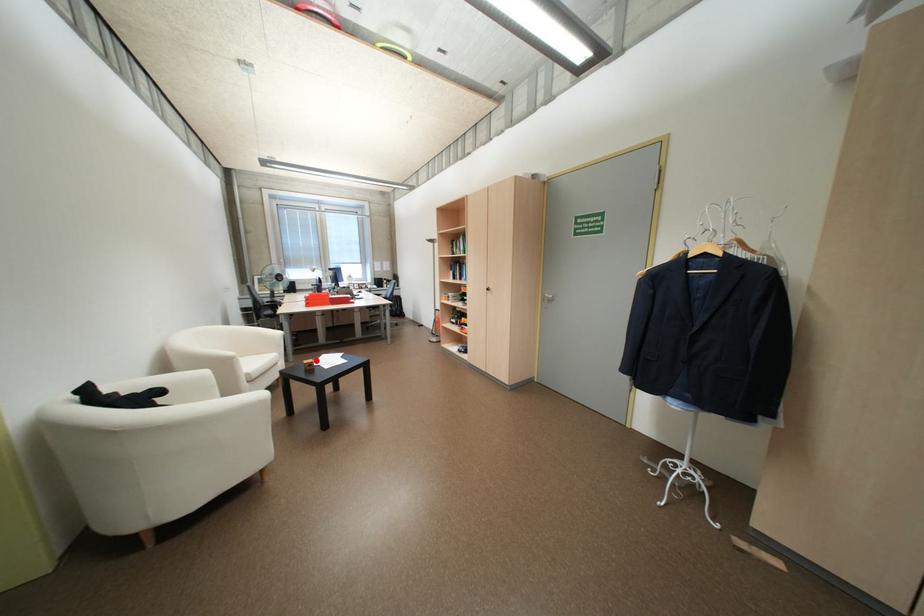
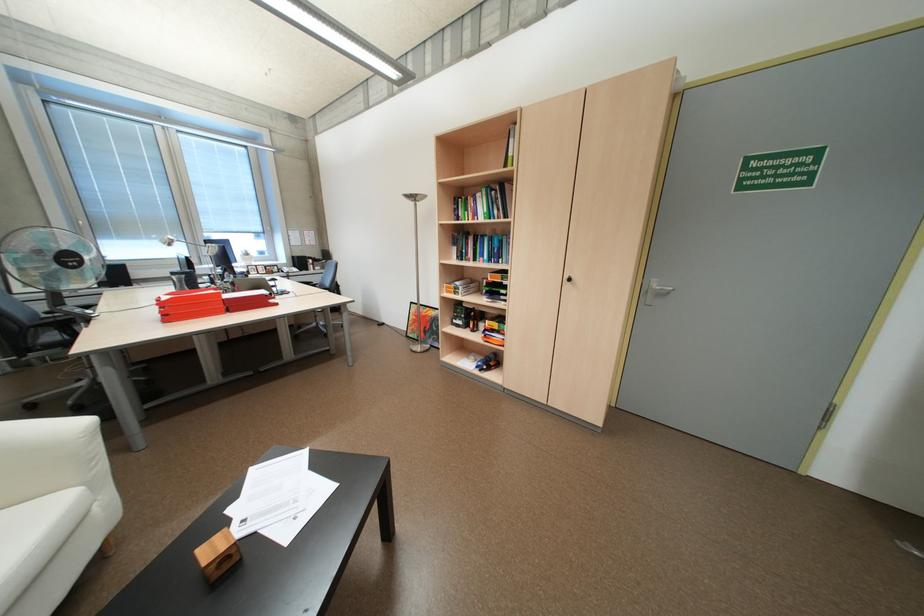
Where in the second image is the point corresponding to the highlighted location from the first image?

(217, 551)